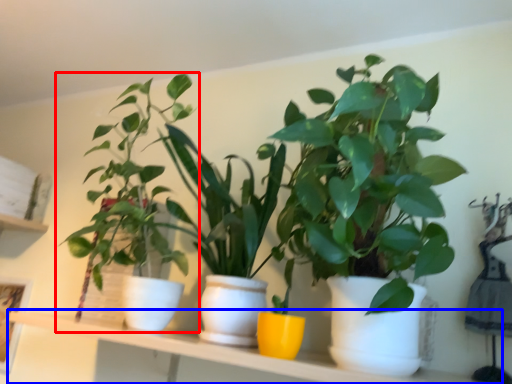
Question: Which point is closer to the camera, houseplant (highlighted by a red box) or window sill (highlighted by a blue box)?

Choices:
 (A) houseplant
 (B) window sill

Answer: (B)